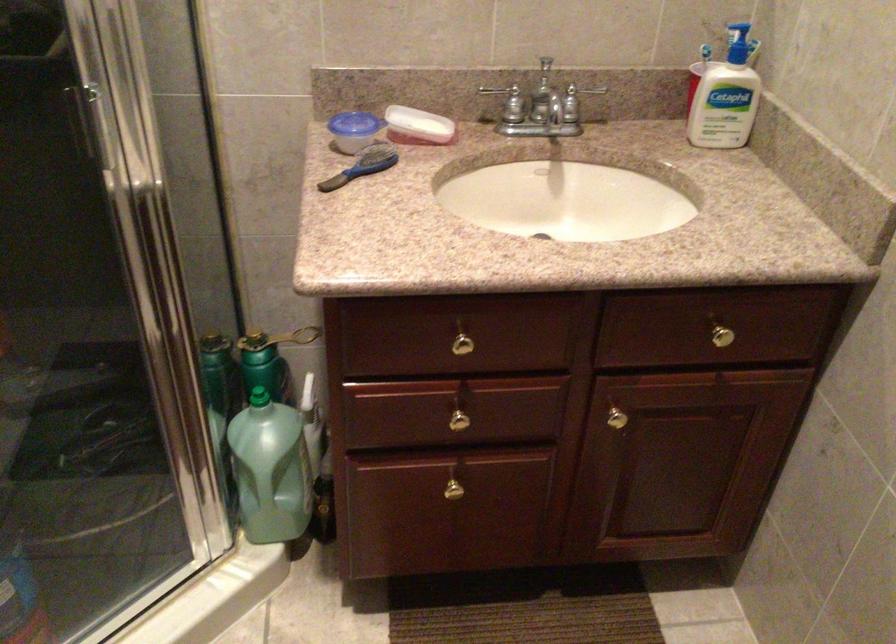
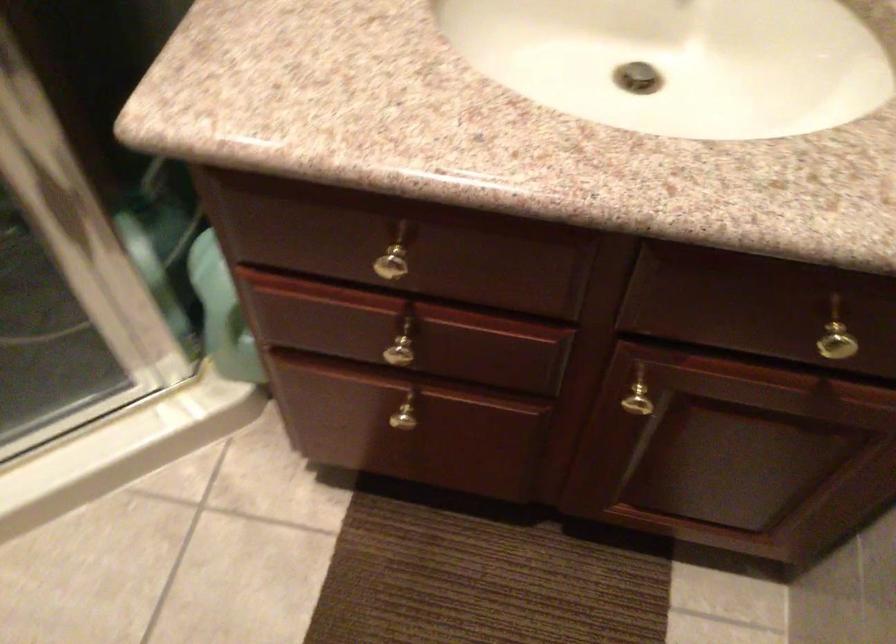
Find the pixel in the second image that matches point 460,420 in the first image.

(401, 354)